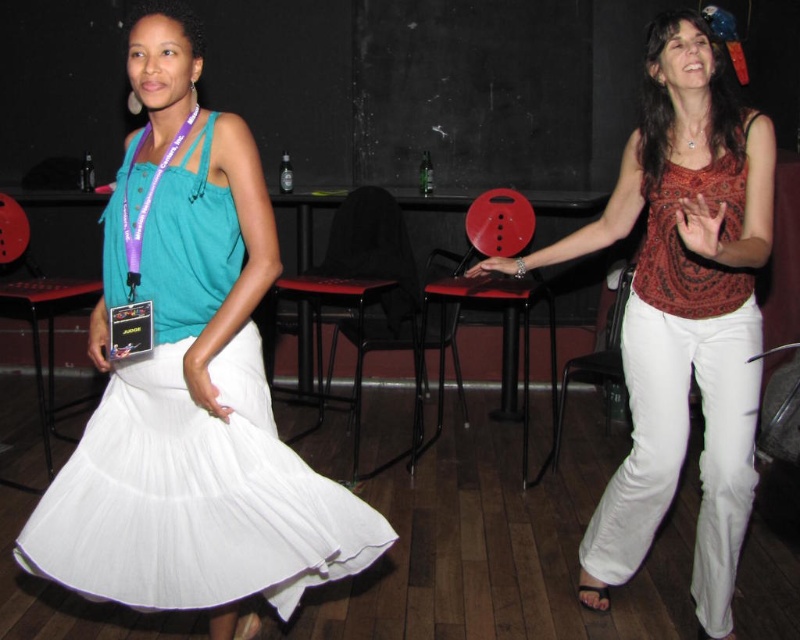
You are a photographer trying to capture a closeup of both the white pleated skirt at center and the matte red blouse at center in the image. Which one should you focus on first if you want to ensure both are in frame without moving the camera?

The white pleated skirt at center is smaller than the matte red blouse at center, so you should focus on the white pleated skirt at center first to ensure it fits within the frame before adjusting for the larger matte red blouse at center.

Based on the scene description, where exactly is the white pleated skirt at center located in terms of coordinates?

The white pleated skirt at center is located at point (190, 385).

Based on the photo, you are a photographer trying to capture a photo of both the white pleated skirt at center and the matte red blouse at center. Which one should you focus on first if you want to include both in your frame?

The white pleated skirt at center is positioned on the left side of matte red blouse at center, so you should focus on the white pleated skirt at center first to ensure both are in frame.